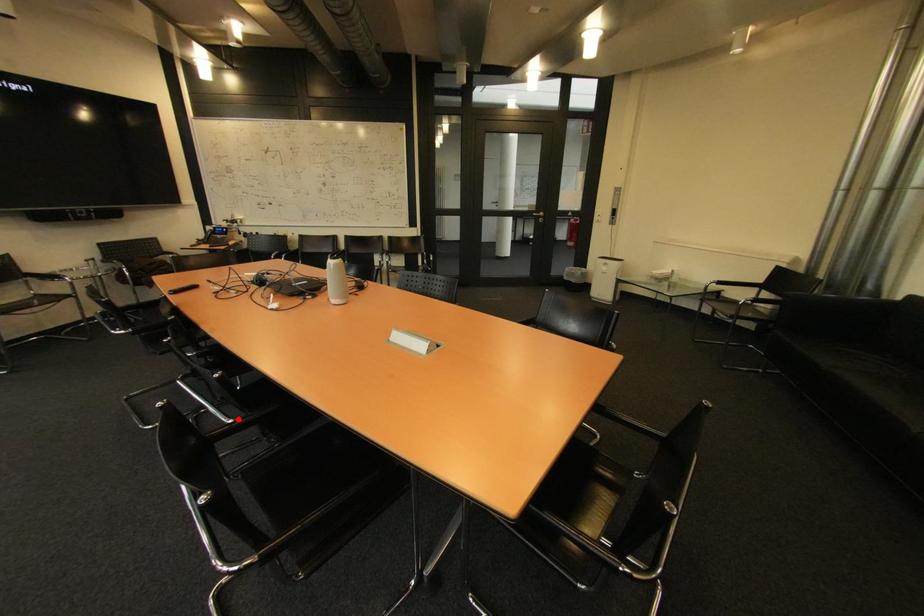
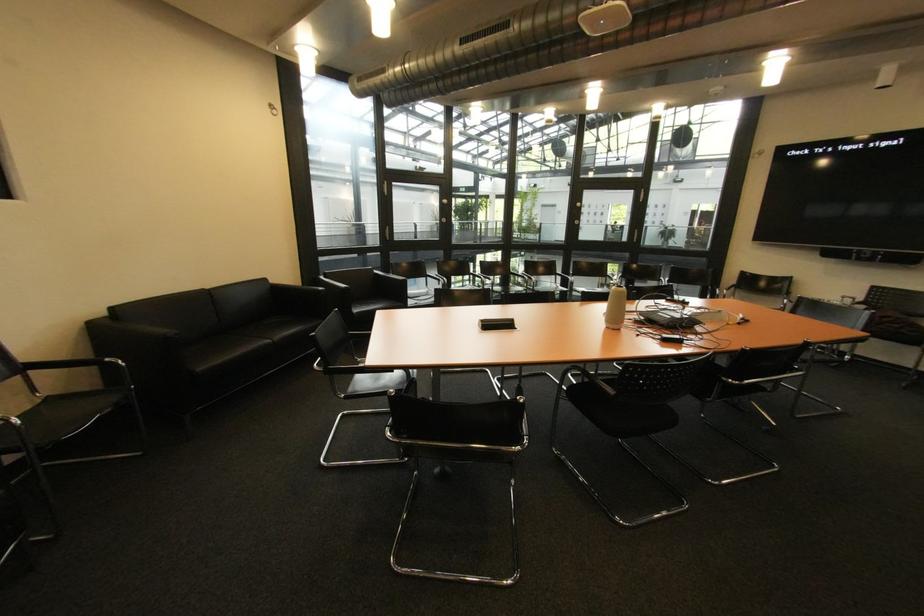
Question: I am providing you with two images of the same scene from different viewpoints. A red point is marked on the first image. Can you still see the location of the red point in image 2?

Choices:
 (A) Yes
 (B) No

Answer: (B)